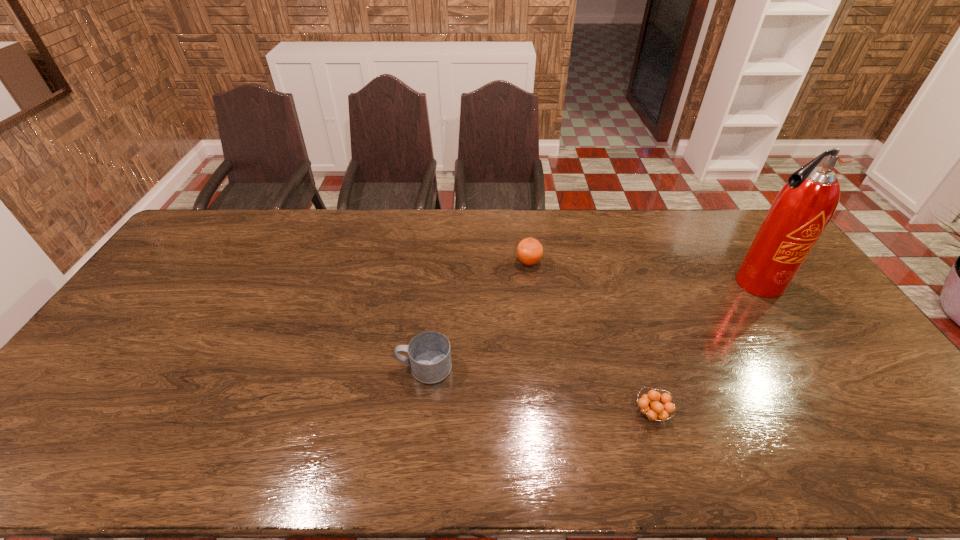
Identify the location of vacant space situated 0.060m on the side of the second nearest object with the handle. The image size is (960, 540). (374, 367).

This screenshot has height=540, width=960. Find the location of `vacant position located 0.380m on the side of the second nearest object with the handle`. vacant position located 0.380m on the side of the second nearest object with the handle is located at coordinates (256, 367).

Find the location of a particular element. Image resolution: width=960 pixels, height=540 pixels. free space located on the side of the second nearest object with the handle is located at coordinates (371, 367).

At what (x,y) coordinates should I click in order to perform the action: click on vacant space located 0.220m on the back of the nearest object. Please return your answer as a coordinate pair (x, y). Looking at the image, I should click on click(x=626, y=331).

You are a GUI agent. You are given a task and a screenshot of the screen. Output one action in this format:
    pyautogui.click(x=<x>, y=<y>)
    Task: Click on the object located at the right edge
    This screenshot has height=540, width=960.
    Given the screenshot: What is the action you would take?
    pyautogui.click(x=801, y=211)

Image resolution: width=960 pixels, height=540 pixels. Identify the location of vacant space at the far edge. (727, 242).

At what (x,y) coordinates should I click in order to perform the action: click on vacant space at the near edge of the desktop. Please return your answer as a coordinate pair (x, y). Looking at the image, I should click on (130, 444).

Where is `free space at the left edge`? The image size is (960, 540). free space at the left edge is located at coordinates (123, 322).

Identify the location of vacant space at the right edge of the desktop. This screenshot has width=960, height=540. (850, 387).

Locate an element on the screen. The height and width of the screenshot is (540, 960). blank space at the far left corner of the desktop is located at coordinates (228, 211).